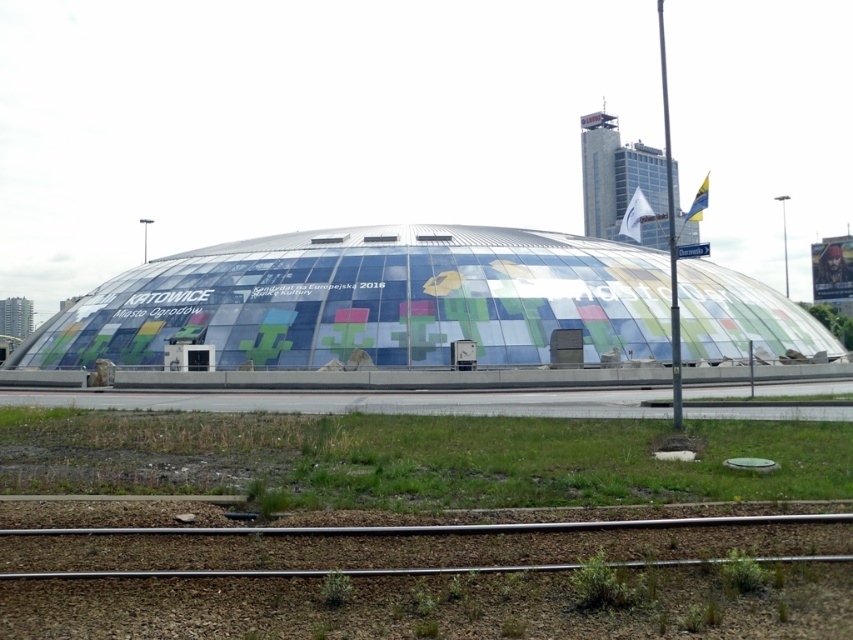
Question: Does metallic train track at lower center have a lesser width compared to green grass at lower center?

Choices:
 (A) yes
 (B) no

Answer: (A)

Question: Which is farther from the transparent glass dome at center?

Choices:
 (A) metallic train track at lower center
 (B) green grass at lower center

Answer: (A)

Question: Does transparent glass dome at center have a greater width compared to green grass at lower center?

Choices:
 (A) yes
 (B) no

Answer: (A)

Question: Can you confirm if metallic train track at lower center is bigger than green grass at lower center?

Choices:
 (A) yes
 (B) no

Answer: (B)

Question: Which object is the farthest from the metallic train track at lower center?

Choices:
 (A) transparent glass dome at center
 (B) green grass at lower center

Answer: (A)

Question: Estimate the real-world distances between objects in this image. Which object is farther from the metallic train track at lower center?

Choices:
 (A) green grass at lower center
 (B) transparent glass dome at center

Answer: (B)